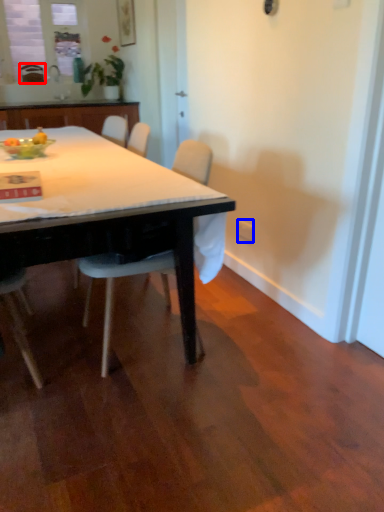
Question: Which point is closer to the camera, chair (highlighted by a red box) or power outlet (highlighted by a blue box)?

Choices:
 (A) chair
 (B) power outlet

Answer: (B)